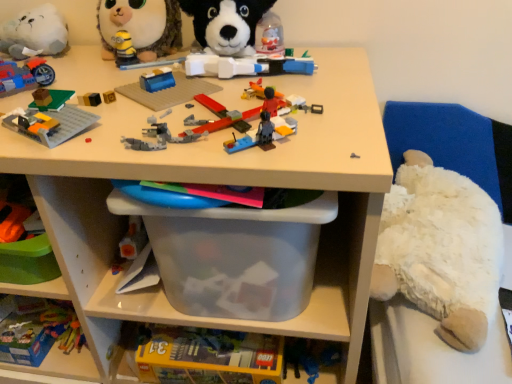
Identify the location of vacant area located to the right-hand side of matte blue motorcycle at upper left, the 3th toy positioned from the left. (119, 81).